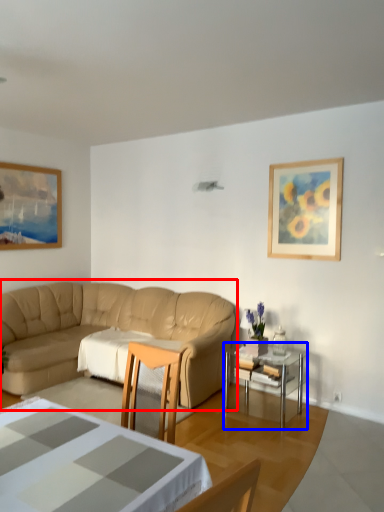
Question: Which of the following is the closest to the observer, studio couch (highlighted by a red box) or table (highlighted by a blue box)?

Choices:
 (A) studio couch
 (B) table

Answer: (A)